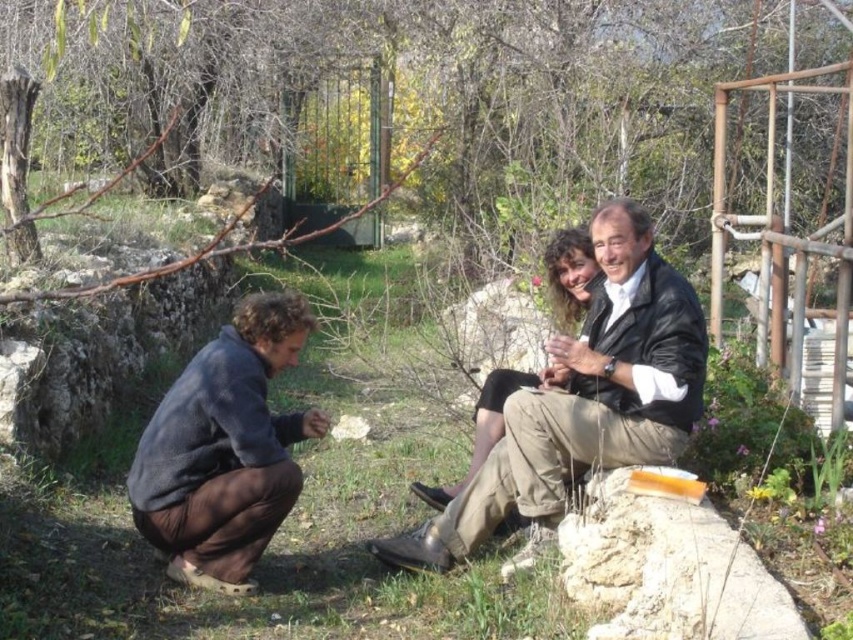
Question: Is green grass at center above dark blue fleece at lower left?

Choices:
 (A) no
 (B) yes

Answer: (A)

Question: Which of the following is the farthest from the observer?

Choices:
 (A) green grass at center
 (B) matte black jacket at center
 (C) dark blue fleece at lower left

Answer: (A)

Question: Based on their relative distances, which object is nearer to the green grass at center?

Choices:
 (A) leather jacket at center
 (B) matte black jacket at center
 (C) dark blue fleece at lower left

Answer: (C)

Question: Which of the following is the farthest from the observer?

Choices:
 (A) dark blue fleece at lower left
 (B) green grass at center
 (C) matte black jacket at center

Answer: (B)

Question: Is green grass at center smaller than dark blue fleece at lower left?

Choices:
 (A) yes
 (B) no

Answer: (A)

Question: Does green grass at center appear on the right side of leather jacket at center?

Choices:
 (A) no
 (B) yes

Answer: (A)